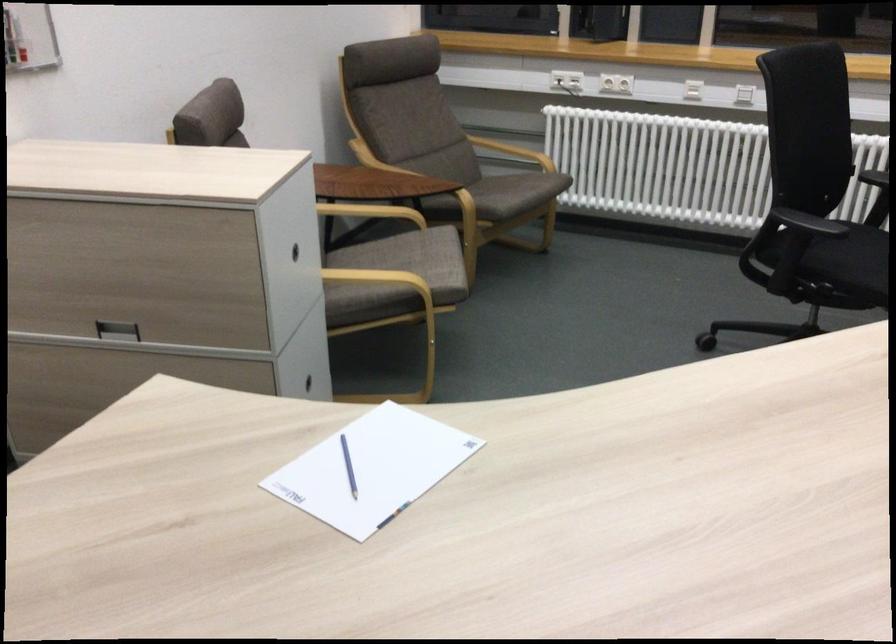
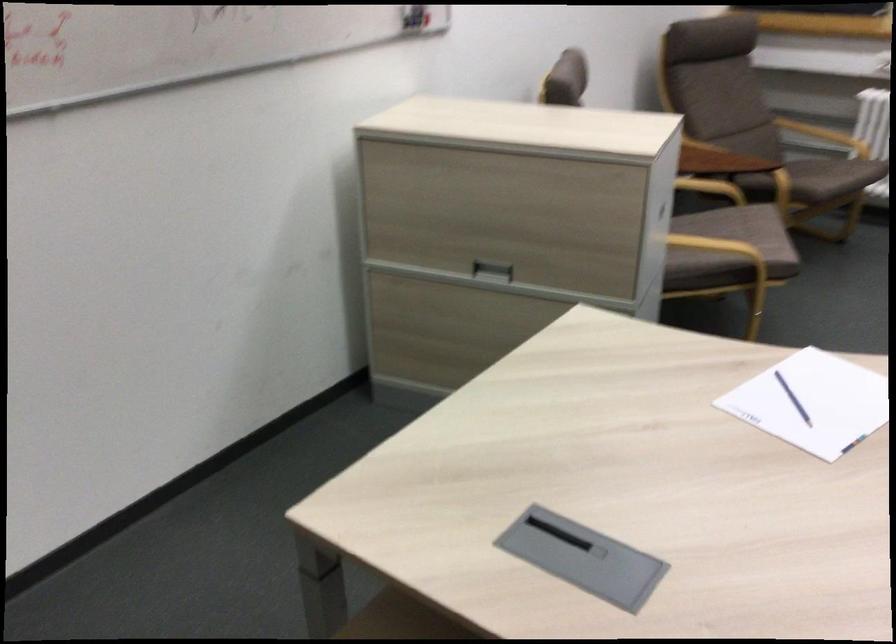
Where in the second image is the point corresponding to the point at 509,194 from the first image?

(831, 176)